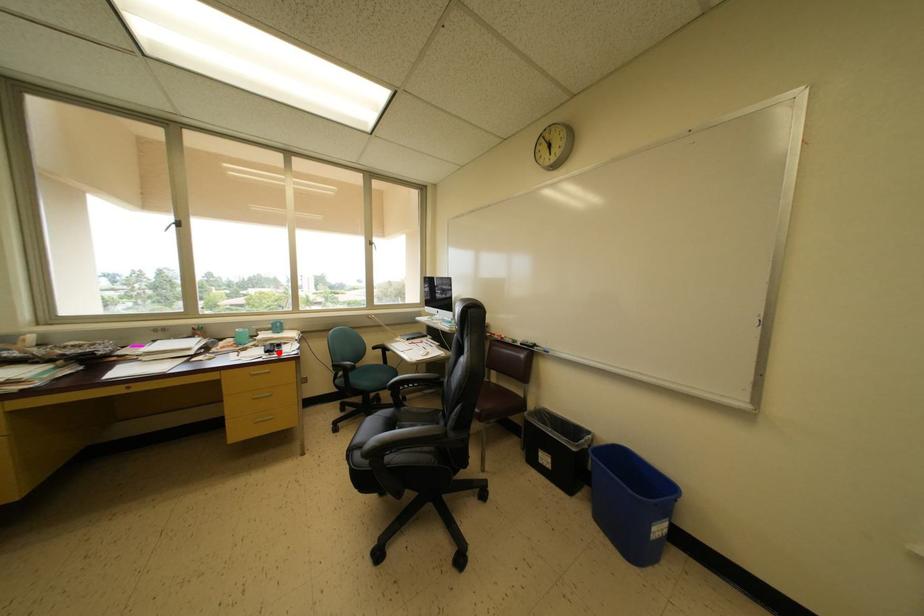
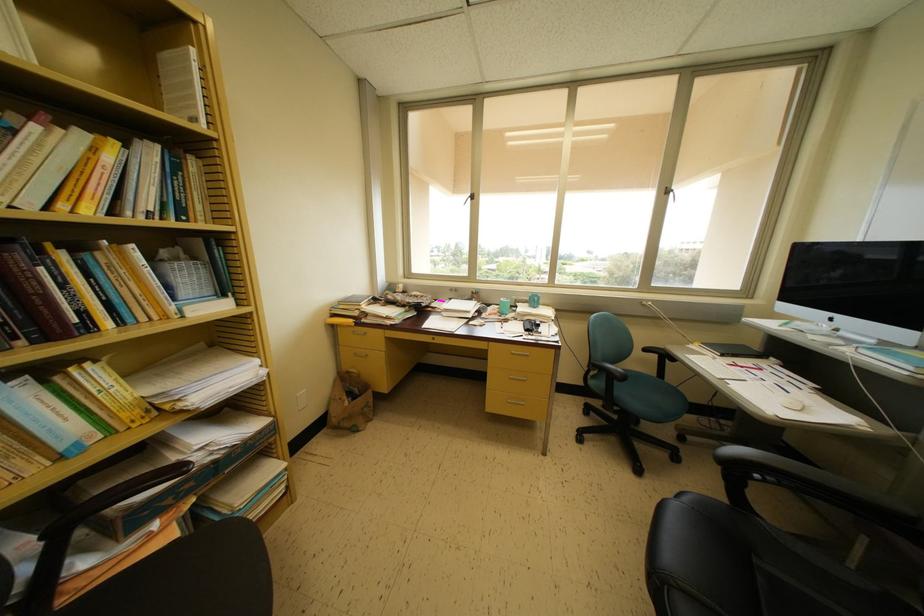
In the second image, find the point that corresponds to the highlighted location in the first image.

(537, 331)